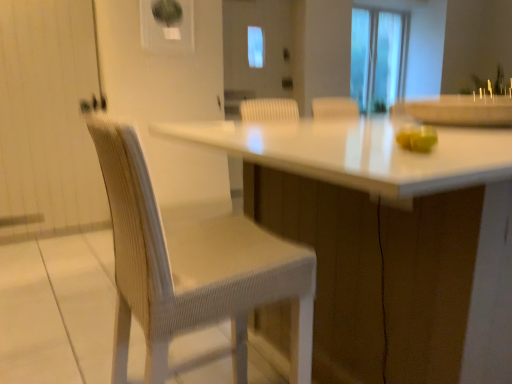
Image resolution: width=512 pixels, height=384 pixels. Identify the location of free space in front of green matte apple at right. (419, 161).